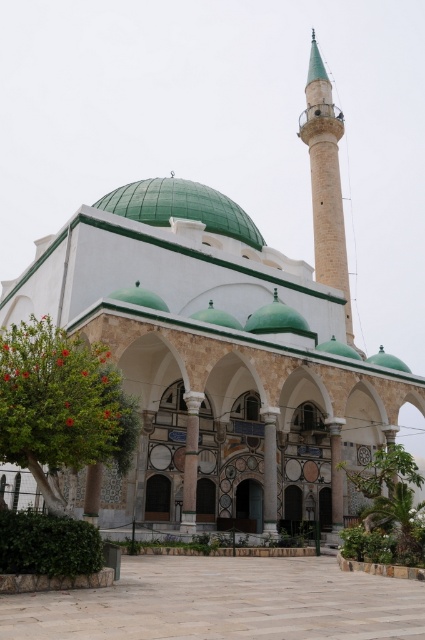
Which is more to the right, green tile dome at center or polished stone arch at center?

Positioned to the right is polished stone arch at center.

Identify the location of green tile dome at center. The width and height of the screenshot is (425, 640). (181, 205).

The height and width of the screenshot is (640, 425). In order to click on green tile dome at center in this screenshot , I will do `click(181, 205)`.

What are the coordinates of `light beige stone minaret at upper center` in the screenshot? It's located at (325, 180).

Which is more to the right, white marble column at center or white marble pillar at center?

Positioned to the right is white marble pillar at center.

Who is more forward, (195, 468) or (340, 445)?

Point (195, 468)

Is point (192, 392) less distant than point (333, 420)?

Yes, point (192, 392) is in front of point (333, 420).

The height and width of the screenshot is (640, 425). Identify the location of white marble column at center. (190, 461).